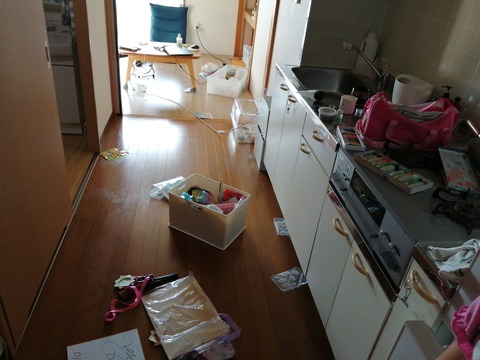
Locate an element on the screen. This screenshot has width=480, height=360. cabinets is located at coordinates (266, 130), (282, 150), (302, 181), (325, 252), (341, 293).